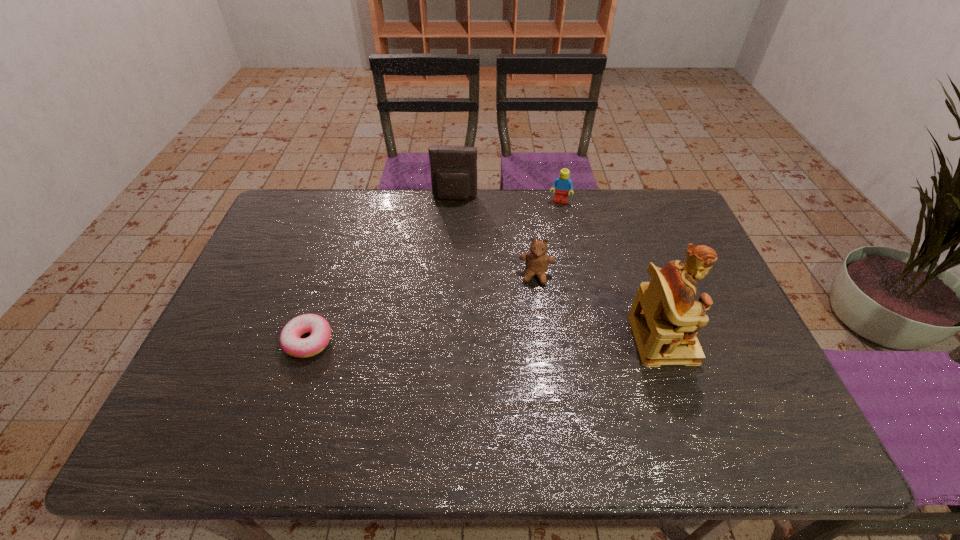
Where is `pouch at the far edge`? This screenshot has height=540, width=960. pouch at the far edge is located at coordinates (453, 168).

At what (x,y) coordinates should I click in order to perform the action: click on Lego located at the far edge. Please return your answer as a coordinate pair (x, y). The height and width of the screenshot is (540, 960). Looking at the image, I should click on (562, 184).

Locate an element on the screen. This screenshot has width=960, height=540. object that is at the right edge is located at coordinates (665, 318).

Where is `vacant region at the far edge of the desktop`? Image resolution: width=960 pixels, height=540 pixels. vacant region at the far edge of the desktop is located at coordinates (398, 217).

At what (x,y) coordinates should I click in order to perform the action: click on vacant point at the near edge. Please return your answer as a coordinate pair (x, y). Looking at the image, I should click on (316, 408).

Identify the location of vacant area at the left edge. This screenshot has width=960, height=540. (245, 273).

Where is `vacant space at the right edge of the desktop`? vacant space at the right edge of the desktop is located at coordinates (653, 238).

You are a GUI agent. You are given a task and a screenshot of the screen. Output one action in this format:
    pyautogui.click(x=<x>, y=<y>)
    Task: Click on the free region at the far left corner of the desktop
    The image size is (960, 540).
    Given the screenshot: What is the action you would take?
    pyautogui.click(x=316, y=227)

Image resolution: width=960 pixels, height=540 pixels. I want to click on free spot at the far right corner of the desktop, so click(x=631, y=191).

The height and width of the screenshot is (540, 960). Find the location of `free space between the Lego and the doughnut`. free space between the Lego and the doughnut is located at coordinates pyautogui.click(x=434, y=271).